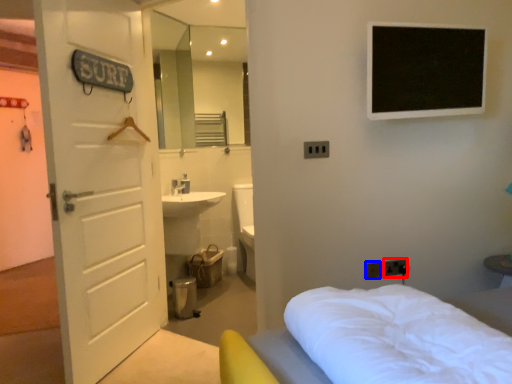
Question: Which point is further to the camera, electric outlet (highlighted by a red box) or electric outlet (highlighted by a blue box)?

Choices:
 (A) electric outlet
 (B) electric outlet

Answer: (A)